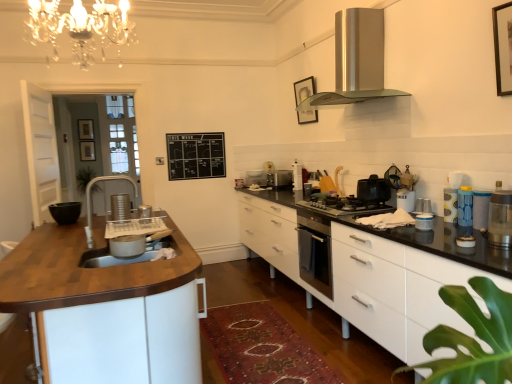
Question: Would you say satin silver range hood at upper center is to the left or to the right of translucent plastic container at right, which is the 2th kitchen appliance in back-to-front order, in the picture?

Choices:
 (A) left
 (B) right

Answer: (A)

Question: In terms of height, does satin silver range hood at upper center look taller or shorter compared to translucent plastic container at right, which is the 2th kitchen appliance in back-to-front order?

Choices:
 (A) tall
 (B) short

Answer: (A)

Question: Estimate the real-world distances between objects in this image. Which object is closer to the wooden at left?

Choices:
 (A) wooden picture frame at upper left, which is the 3th picture frame from right to left
 (B) metallic silver toaster at upper right, which ranks as the 8th appliance in left-to-right order
 (C) wooden picture frame at upper center, which appears as the third picture frame when viewed from the back
 (D) translucent plastic container at right, which is the 2th kitchen appliance in back-to-front order
 (E) satin silver range hood at upper center

Answer: (D)

Question: Based on their relative distances, which object is farther from the metallic silver coffee maker at upper right, marked as the fifth appliance in a back-to-front arrangement?

Choices:
 (A) brushed metal faucet at left
 (B) black glass stove at center, arranged as the 3th appliance when viewed from the back
 (C) white glossy container at right, which appears as the seventh appliance when viewed from the left
 (D) translucent plastic container at right, arranged as the 11th appliance when viewed from the left
 (E) black matte coffee maker at center, the first kitchen appliance in the back-to-front sequence

Answer: (A)